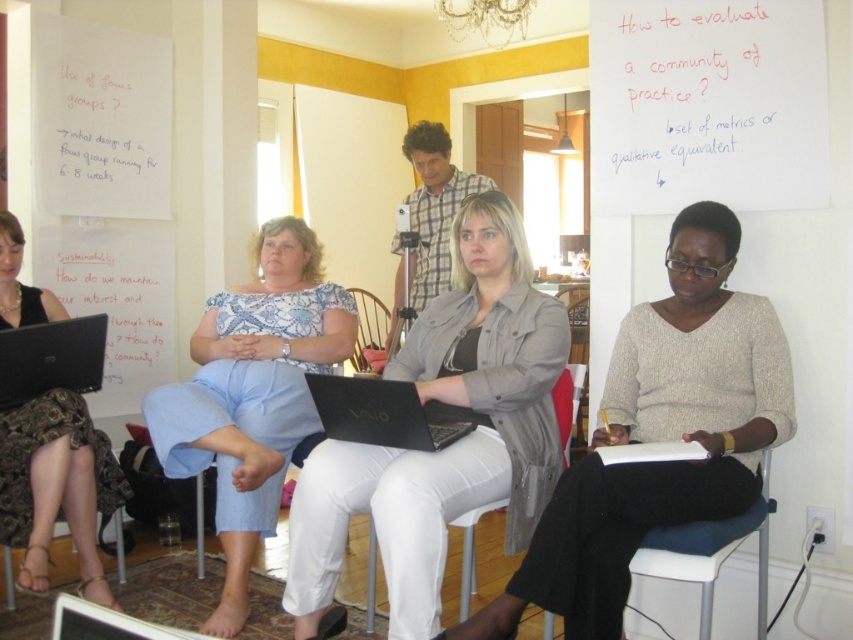
Consider the image. Can you confirm if matte gray jacket at center is smaller than whiteboard at upper right?

No.

Does matte gray jacket at center lie behind whiteboard at upper right?

No, matte gray jacket at center is closer to the viewer.

What are the coordinates of `matte gray jacket at center` in the screenshot? It's located at (444, 419).

You are a GUI agent. You are given a task and a screenshot of the screen. Output one action in this format:
    pyautogui.click(x=<x>, y=<y>)
    Task: Click on the matte gray jacket at center
    This screenshot has width=853, height=640.
    Given the screenshot: What is the action you would take?
    pyautogui.click(x=444, y=419)

Is point (231, 314) farther from viewer compared to point (692, 561)?

Yes, point (231, 314) is farther from viewer.

Does blue cotton pants at center have a smaller size compared to blue fabric chair at lower right?

Actually, blue cotton pants at center might be larger than blue fabric chair at lower right.

Who is more distant from viewer, (271, 268) or (688, 534)?

Positioned behind is point (271, 268).

Identify the location of blue cotton pants at center. The height and width of the screenshot is (640, 853). [252, 396].

From the picture: Which is more to the left, blue cotton pants at center or white plastic chair at center?

blue cotton pants at center is more to the left.

Is blue cotton pants at center below white plastic chair at center?

Actually, blue cotton pants at center is above white plastic chair at center.

Locate an element on the screen. blue cotton pants at center is located at coordinates (252, 396).

What are the coordinates of `blue cotton pants at center` in the screenshot? It's located at (252, 396).